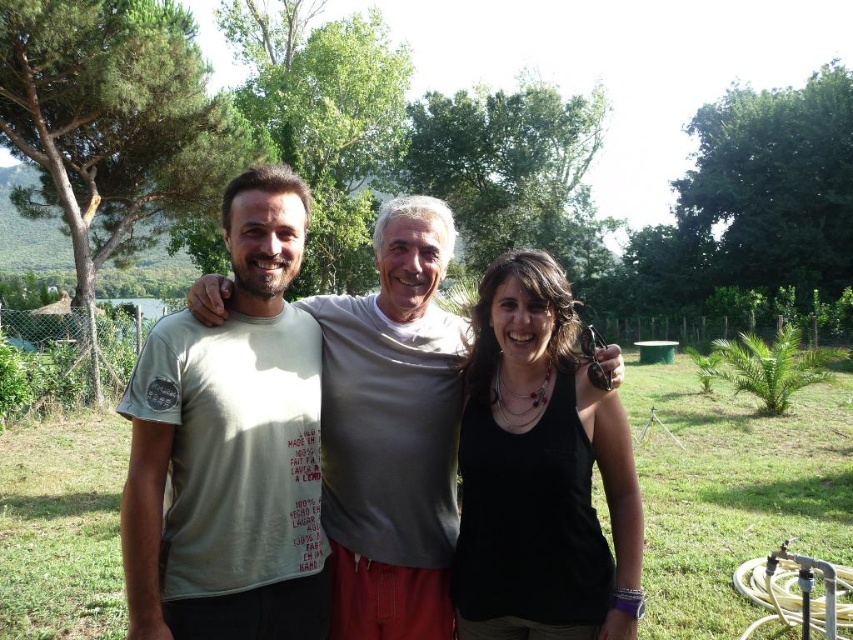
Is black matte tank top at center taller than green leafy tree at left?

No, black matte tank top at center is not taller than green leafy tree at left.

In order to click on black matte tank top at center in this screenshot , I will do `click(540, 472)`.

Is green leafy tree at center wider than green leafy tree at upper center?

Incorrect, green leafy tree at center's width does not surpass green leafy tree at upper center's.

Is point (329, 273) closer to viewer compared to point (583, 145)?

Yes, it is in front of point (583, 145).

Does point (351, 253) lie behind point (415, 115)?

No, it is in front of (415, 115).

At what (x,y) coordinates should I click in order to perform the action: click on green leafy tree at center. Please return your answer as a coordinate pair (x, y). This screenshot has width=853, height=640. Looking at the image, I should click on (323, 118).

Does green leafy tree at left appear over green leafy tree at upper center?

No.

Consider the image. Is green leafy tree at left bigger than green leafy tree at upper center?

Yes.

Identify the location of green leafy tree at left. Image resolution: width=853 pixels, height=640 pixels. (112, 124).

I want to click on green leafy tree at left, so click(x=112, y=124).